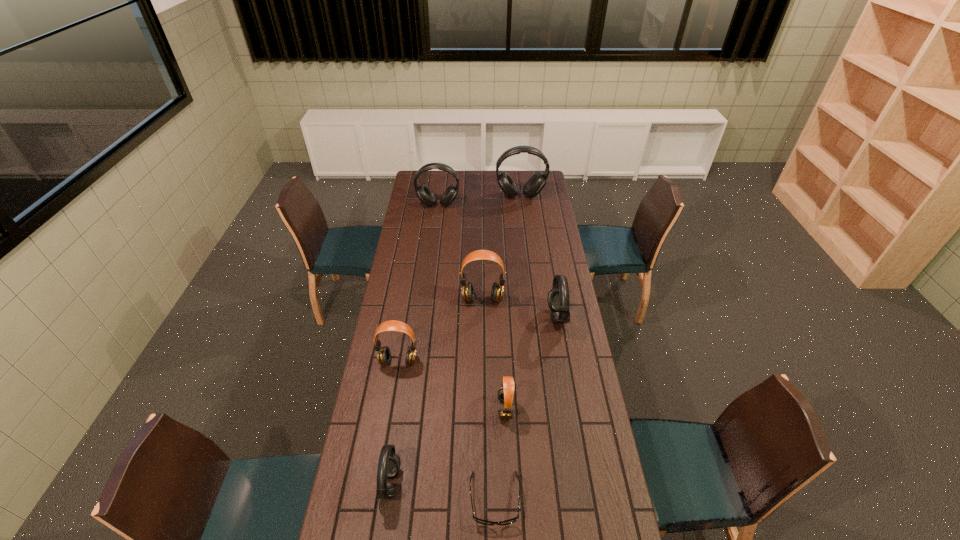
This screenshot has width=960, height=540. I want to click on the nearest headset, so click(389, 463).

This screenshot has height=540, width=960. Identify the location of spectacles. (481, 521).

I want to click on free region located 0.320m on the earcups of the tallest headset, so click(x=525, y=235).

This screenshot has height=540, width=960. What are the coordinates of `free point located on the earcups of the second biggest gray headset` in the screenshot? It's located at (434, 239).

Identify the location of vacant space located on the ear cups of the farthest brown headset. This screenshot has width=960, height=540. (483, 339).

Where is `blank area located 0.160m on the earcups of the third biggest gray headset`? This screenshot has width=960, height=540. blank area located 0.160m on the earcups of the third biggest gray headset is located at coordinates (511, 316).

Find the location of a particular element. free space located 0.050m on the earcups of the third biggest gray headset is located at coordinates (537, 316).

Identify the location of free space located on the earcups of the third biggest gray headset. (460, 316).

Where is `vacant space located 0.100m on the ear cups of the fourth nearest object`? vacant space located 0.100m on the ear cups of the fourth nearest object is located at coordinates (394, 392).

You are a GUI agent. You are given a task and a screenshot of the screen. Output one action in this format:
    pyautogui.click(x=<x>, y=<y>)
    Task: Click on the vacant space located 0.340m on the ear cups of the sixth farthest object
    Image resolution: width=960 pixels, height=540 pixels.
    Given the screenshot: What is the action you would take?
    pyautogui.click(x=402, y=408)